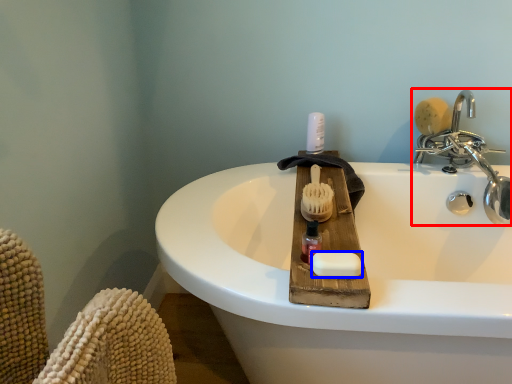
Question: Which object is closer to the camera taking this photo, tap (highlighted by a red box) or soap (highlighted by a blue box)?

Choices:
 (A) tap
 (B) soap

Answer: (B)